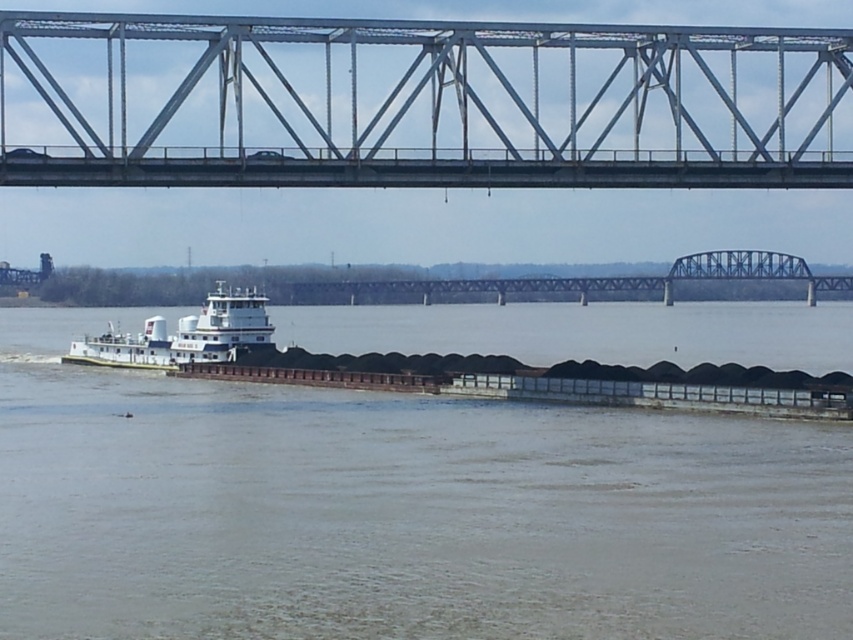
Is the position of brown matte barge at center less distant than that of metal bridge at upper center?

Yes, it is in front of metal bridge at upper center.

Between brown matte barge at center and metal bridge at upper center, which one is positioned lower?

brown matte barge at center

Is point (390, 556) closer to camera compared to point (817, 52)?

Yes, point (390, 556) is closer to viewer.

Locate an element on the screen. brown matte barge at center is located at coordinates (398, 509).

Does metal bridge at upper center appear under white matte barge at lower left?

Incorrect, metal bridge at upper center is not positioned below white matte barge at lower left.

Which is above, metal bridge at upper center or white matte barge at lower left?

Positioned higher is metal bridge at upper center.

Identify the location of metal bridge at upper center. (444, 104).

Between brown matte barge at center and white matte barge at lower left, which one has more height?

white matte barge at lower left is taller.

Between point (834, 424) and point (218, 310), which one is positioned behind?

Positioned behind is point (218, 310).

This screenshot has height=640, width=853. What are the coordinates of `brown matte barge at center` in the screenshot? It's located at (398, 509).

Where is `brown matte barge at center`? This screenshot has height=640, width=853. brown matte barge at center is located at coordinates (398, 509).